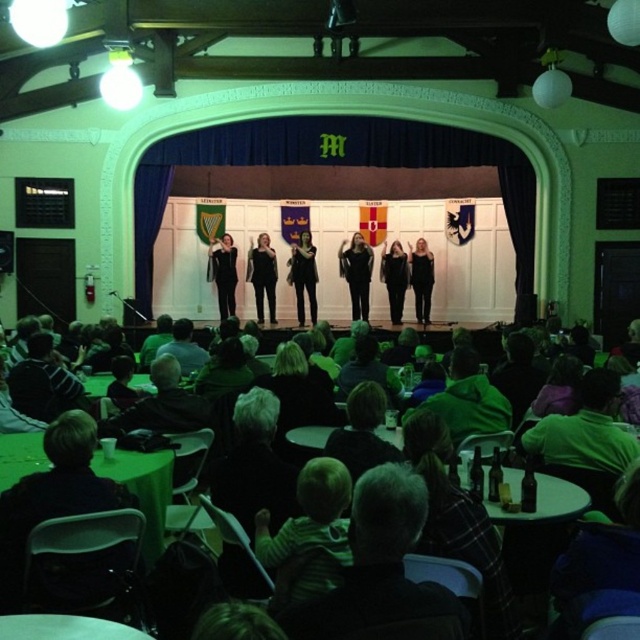
Who is positioned more to the left, dark gray shirt at lower left or dark gray shirt at center?

From the viewer's perspective, dark gray shirt at center appears more on the left side.

In the scene shown: Does dark gray shirt at lower left have a larger size compared to dark gray shirt at center?

No.

Is point (129, 428) farther from viewer compared to point (192, 330)?

No, it is in front of (192, 330).

Where is `dark gray shirt at lower left`? This screenshot has width=640, height=640. dark gray shirt at lower left is located at coordinates (163, 404).

Is black fabric dress at center bigger than dark gray shirt at center?

No, black fabric dress at center is not bigger than dark gray shirt at center.

Find the location of `black fabric dress at center`. black fabric dress at center is located at coordinates coord(262,275).

You are a GUI agent. You are given a task and a screenshot of the screen. Output one action in this format:
    pyautogui.click(x=<x>, y=<y>)
    Task: Click on the black fabric dress at center
    This screenshot has height=640, width=640.
    Given the screenshot: What is the action you would take?
    pyautogui.click(x=262, y=275)

Can you confirm if dark gray shirt at lower center is thinner than dark gray shirt at lower left?

Yes, dark gray shirt at lower center is thinner than dark gray shirt at lower left.

Which is more to the left, dark gray shirt at lower center or dark gray shirt at lower left?

Positioned to the left is dark gray shirt at lower left.

Where is `dark gray shirt at lower center`? This screenshot has width=640, height=640. dark gray shirt at lower center is located at coordinates (378, 563).